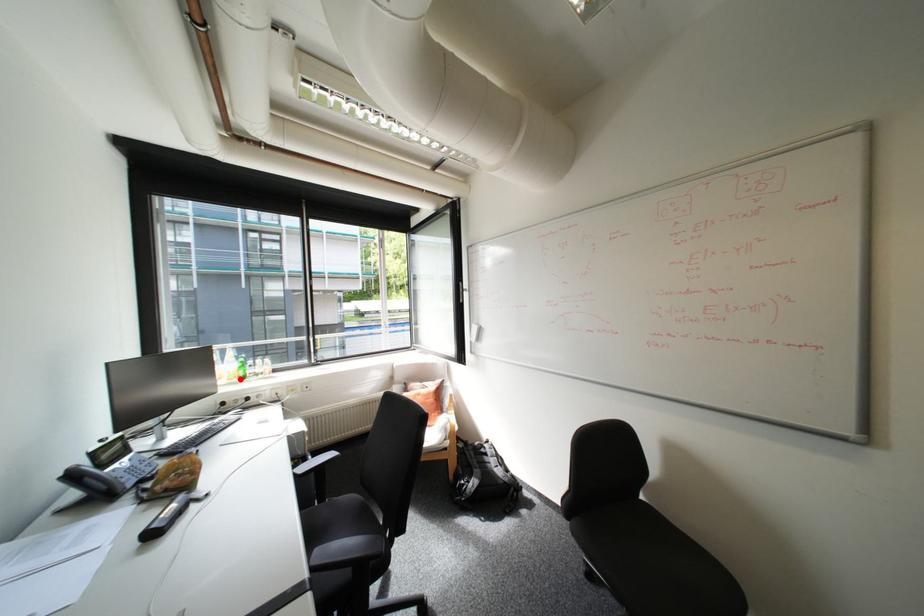
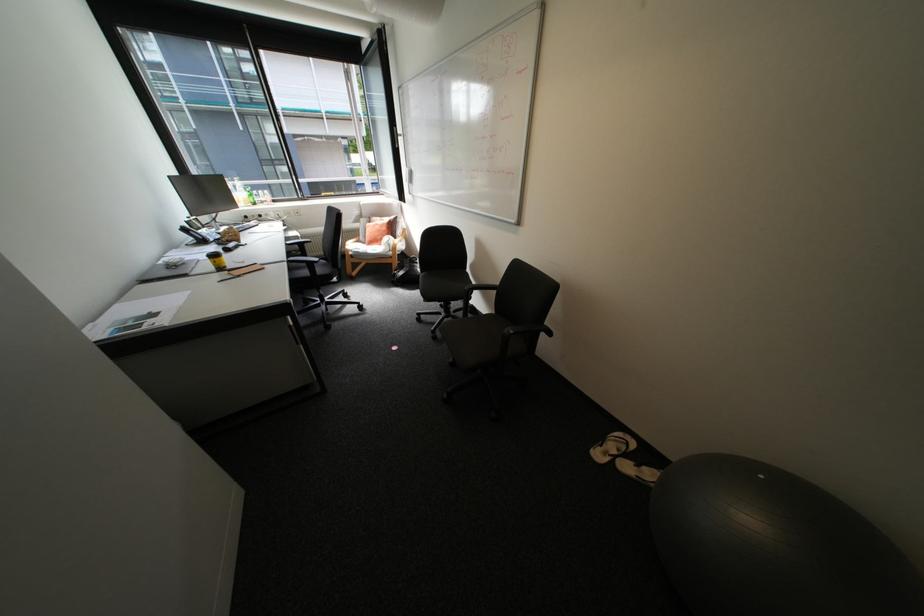
Question: I am providing you with two images of the same scene from different viewpoints. A red point is shown in image1. For the corresponding object point in image2, is it positioned nearer or farther from the camera?

Choices:
 (A) Nearer
 (B) Farther

Answer: (A)